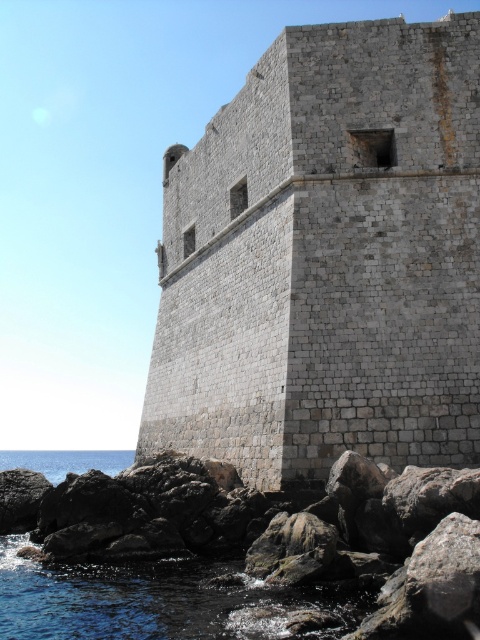
Question: Is gray stone wall at center to the left of rough stone rocks at lower left from the viewer's perspective?

Choices:
 (A) yes
 (B) no

Answer: (B)

Question: Based on their relative distances, which object is nearer to the rough stone rocks at lower left?

Choices:
 (A) gray stone wall at center
 (B) blue water at lower left

Answer: (B)

Question: Considering the relative positions of rough stone rocks at lower left and blue water at lower left in the image provided, where is rough stone rocks at lower left located with respect to blue water at lower left?

Choices:
 (A) above
 (B) below

Answer: (A)

Question: Which is nearer to the gray stone wall at center?

Choices:
 (A) rough stone rocks at lower left
 (B) blue water at lower left

Answer: (A)

Question: Which point is farther from the camera taking this photo?

Choices:
 (A) (107, 600)
 (B) (375, 140)
 (C) (103, 472)

Answer: (C)

Question: Can you confirm if rough stone rocks at lower left is positioned below blue water at lower left?

Choices:
 (A) yes
 (B) no

Answer: (B)